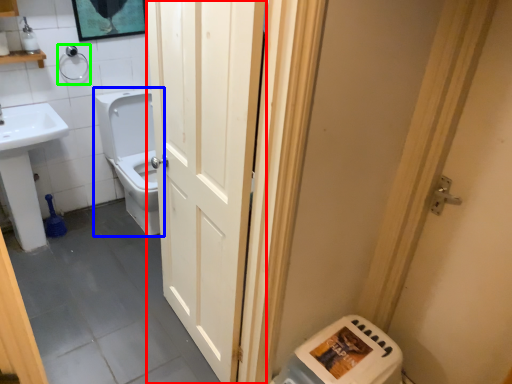
Question: Estimate the real-world distances between objects in this image. Which object is farther from door (highlighted by a red box), toilet (highlighted by a blue box) or towel bar (highlighted by a green box)?

Choices:
 (A) toilet
 (B) towel bar

Answer: (B)